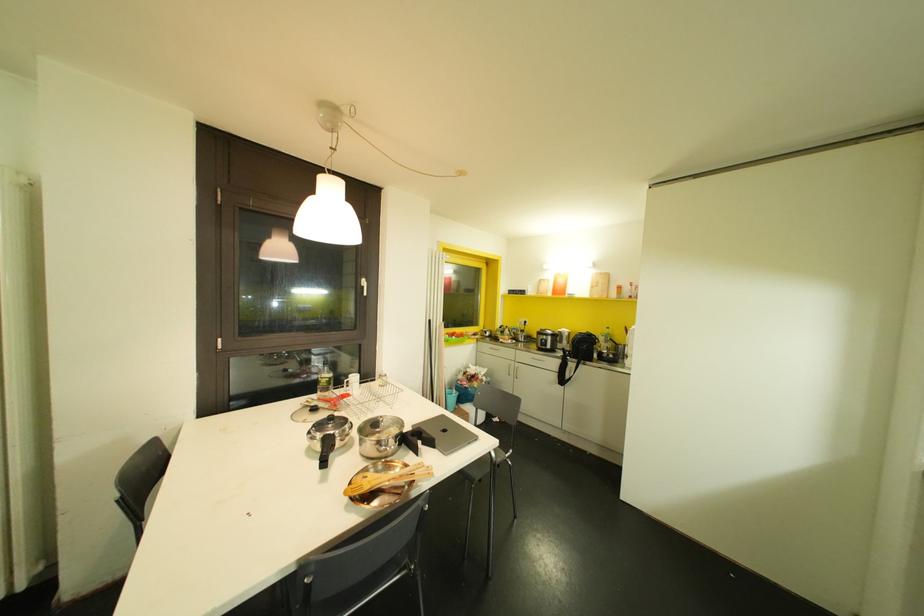
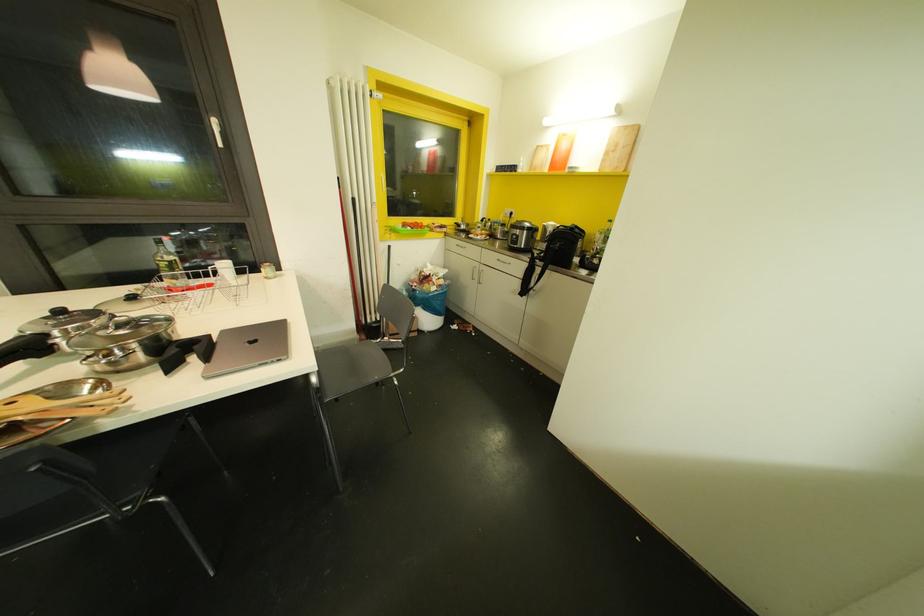
Find the pixel in the second image that matches (x=485, y=346) in the first image.

(453, 243)